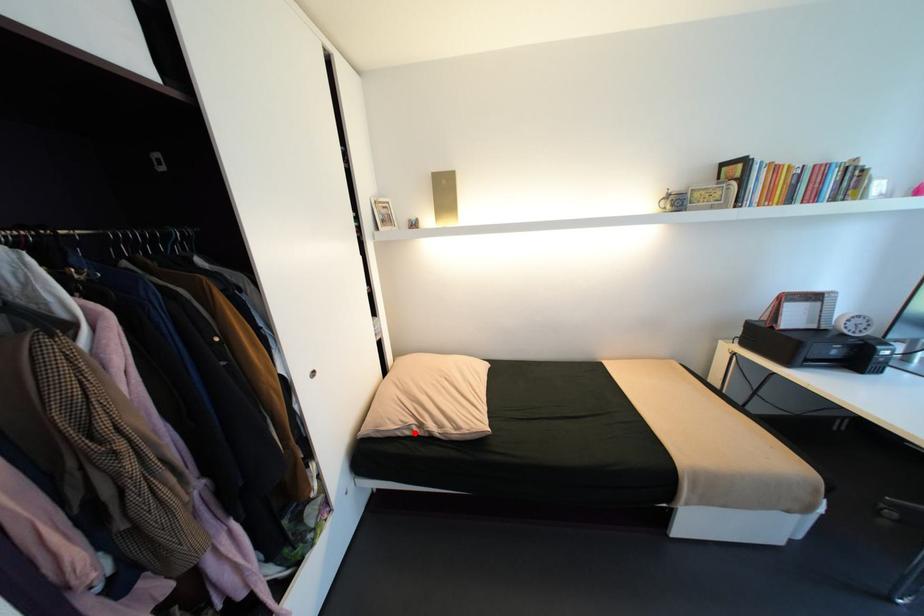
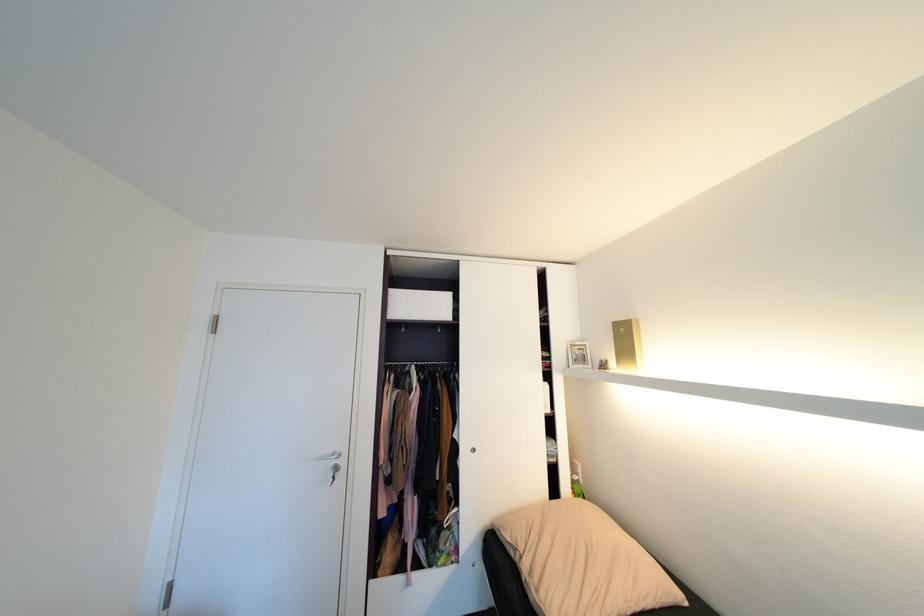
Where in the second image is the point corresponding to the highlighted location from the first image?

(518, 554)